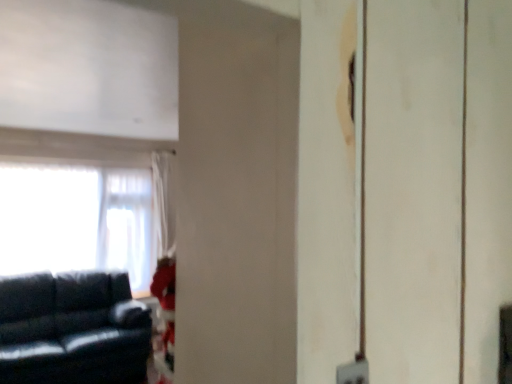
Question: From a real-world perspective, is matte black couch at left beneath white sheer curtain at left?

Choices:
 (A) yes
 (B) no

Answer: (A)

Question: Is matte black couch at left not close to white sheer curtain at left?

Choices:
 (A) yes
 (B) no

Answer: (A)

Question: Is matte black couch at left positioned in front of white sheer curtain at left?

Choices:
 (A) yes
 (B) no

Answer: (A)

Question: From the image's perspective, is matte black couch at left over white sheer curtain at left?

Choices:
 (A) no
 (B) yes

Answer: (A)

Question: Does matte black couch at left come behind white sheer curtain at left?

Choices:
 (A) yes
 (B) no

Answer: (B)

Question: Does matte black couch at left have a lesser width compared to white sheer curtain at left?

Choices:
 (A) yes
 (B) no

Answer: (B)

Question: Considering the relative sizes of white sheer curtain at left and matte black couch at left in the image provided, is white sheer curtain at left bigger than matte black couch at left?

Choices:
 (A) no
 (B) yes

Answer: (A)

Question: Can you confirm if white sheer curtain at left is thinner than matte black couch at left?

Choices:
 (A) yes
 (B) no

Answer: (A)

Question: Is white sheer curtain at left facing away from matte black couch at left?

Choices:
 (A) yes
 (B) no

Answer: (B)

Question: Can you confirm if white sheer curtain at left is shorter than matte black couch at left?

Choices:
 (A) yes
 (B) no

Answer: (B)

Question: Considering the relative sizes of white sheer curtain at left and matte black couch at left in the image provided, is white sheer curtain at left taller than matte black couch at left?

Choices:
 (A) yes
 (B) no

Answer: (A)

Question: From a real-world perspective, does white sheer curtain at left sit lower than matte black couch at left?

Choices:
 (A) yes
 (B) no

Answer: (B)

Question: In terms of width, does white sheer curtain at left look wider or thinner when compared to matte black couch at left?

Choices:
 (A) wide
 (B) thin

Answer: (B)